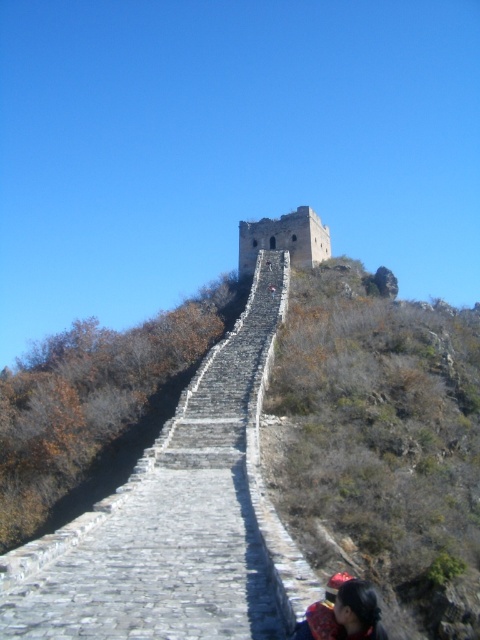
Is stone wall at upper center below dark brown hair at lower right?

Incorrect, stone wall at upper center is not positioned below dark brown hair at lower right.

Who is more distant from viewer, [462,502] or [375,598]?

The point [462,502] is more distant.

Where is `stone wall at upper center`? This screenshot has height=640, width=480. stone wall at upper center is located at coordinates (381, 448).